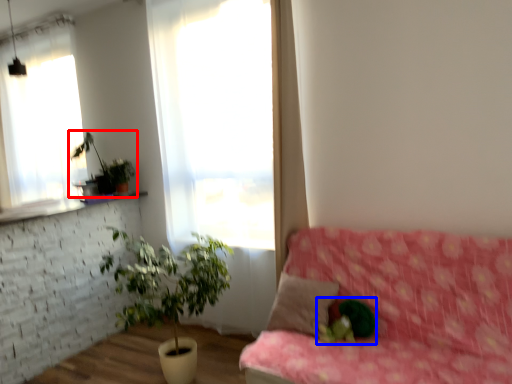
Question: Which object appears closest to the camera in this image, houseplant (highlighted by a red box) or plant (highlighted by a blue box)?

Choices:
 (A) houseplant
 (B) plant

Answer: (B)